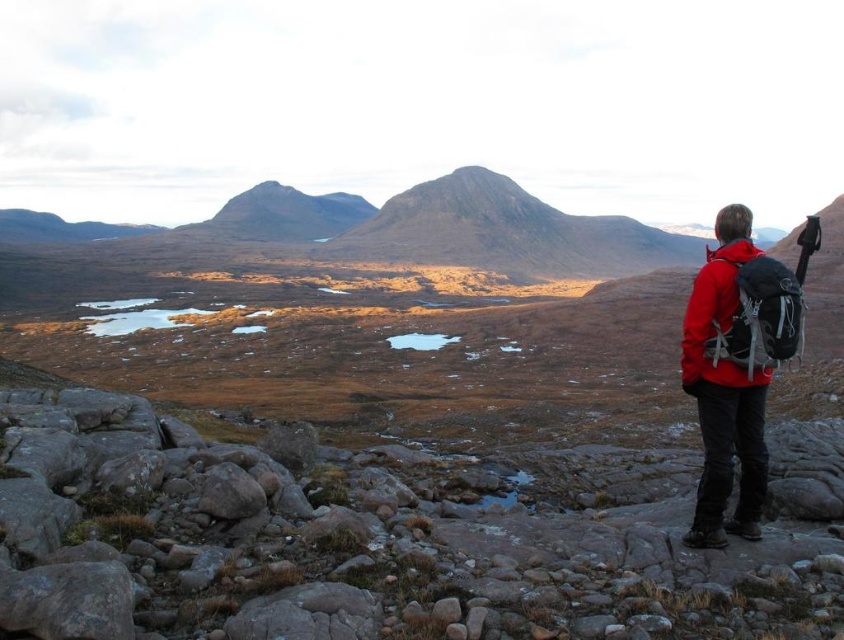
Identify the location of red matte jacket at right. (723, 390).

Does point (742, 448) come behind point (798, 328)?

Yes, point (742, 448) is behind point (798, 328).

Is point (691, 321) farther from camera compared to point (728, 294)?

Yes, it is.

The image size is (844, 640). In order to click on red matte jacket at right in this screenshot , I will do `click(723, 390)`.

Is gray rock at lower right taller than matte red jacket at right?

Yes.

Is gray rock at lower right below matte red jacket at right?

Correct, gray rock at lower right is located below matte red jacket at right.

Is point (62, 410) farther from camera compared to point (793, 276)?

Yes, point (62, 410) is behind point (793, 276).

You are a GUI agent. You are given a task and a screenshot of the screen. Output one action in this format:
    pyautogui.click(x=<x>, y=<y>)
    Task: Click on the gray rock at lower right
    
    Given the screenshot: What is the action you would take?
    pyautogui.click(x=364, y=544)

Which is in front, point (118, 438) or point (706, 508)?

Point (706, 508) is in front.

You are a GUI agent. You are given a task and a screenshot of the screen. Output one action in this format:
    pyautogui.click(x=<x>, y=<y>)
    Task: Click on the gray rock at lower right
    Image resolution: width=844 pixels, height=640 pixels.
    Given the screenshot: What is the action you would take?
    pyautogui.click(x=364, y=544)

What do you see at coordinates (364, 544) in the screenshot? I see `gray rock at lower right` at bounding box center [364, 544].

Locate an element on the screen. The image size is (844, 640). gray rock at lower right is located at coordinates (364, 544).